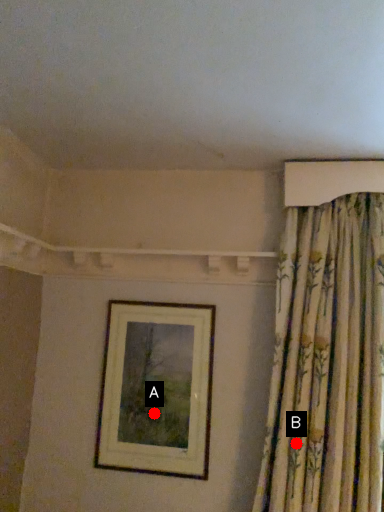
Question: Two points are circled on the image, labeled by A and B beside each circle. Among these points, which one is nearest to the camera?

Choices:
 (A) A is closer
 (B) B is closer

Answer: (B)